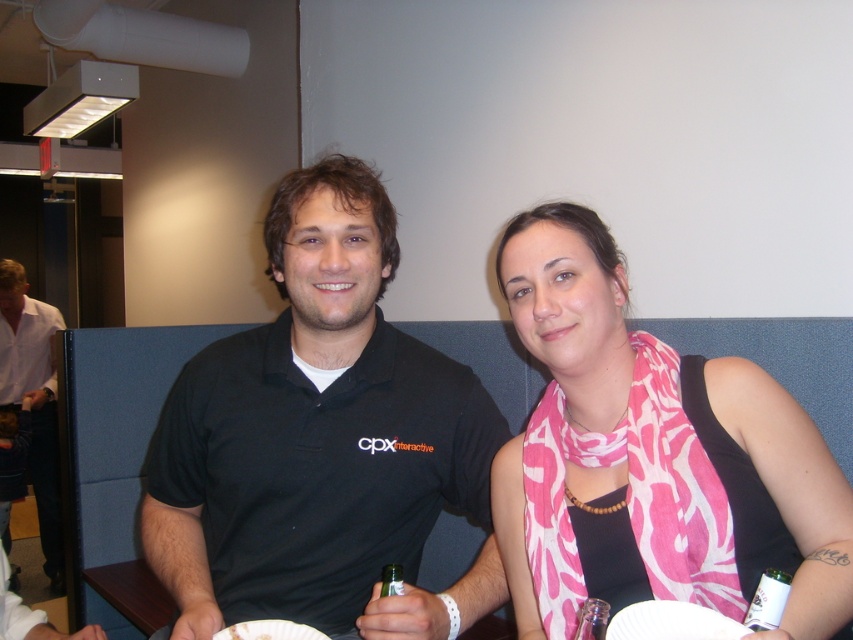
Question: Is pink printed scarf at center bigger than white shirt at left?

Choices:
 (A) yes
 (B) no

Answer: (B)

Question: Estimate the real-world distances between objects in this image. Which object is closer to the pink printed scarf at center?

Choices:
 (A) clear plastic bottle at center
 (B) white shirt at left
 (C) black polo shirt at center
 (D) green glass bottle at lower right

Answer: (C)

Question: Which point is farther to the camera?

Choices:
 (A) (531, 228)
 (B) (53, 312)
 (C) (381, 584)
 (D) (772, 604)

Answer: (B)

Question: Does black polo shirt at center have a greater width compared to pink printed scarf at center?

Choices:
 (A) no
 (B) yes

Answer: (B)

Question: From the image, what is the correct spatial relationship of pink printed scarf at center in relation to clear plastic bottle at center?

Choices:
 (A) below
 (B) above

Answer: (B)

Question: Which of the following is the closest to the observer?

Choices:
 (A) pink printed scarf at center
 (B) green glass bottle at lower right
 (C) clear plastic bottle at center
 (D) black polo shirt at center

Answer: (A)